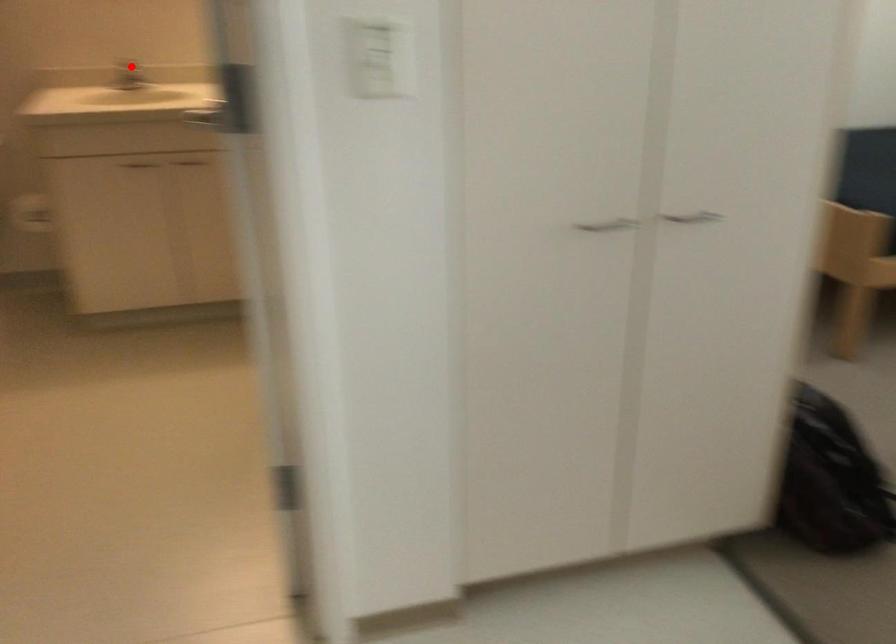
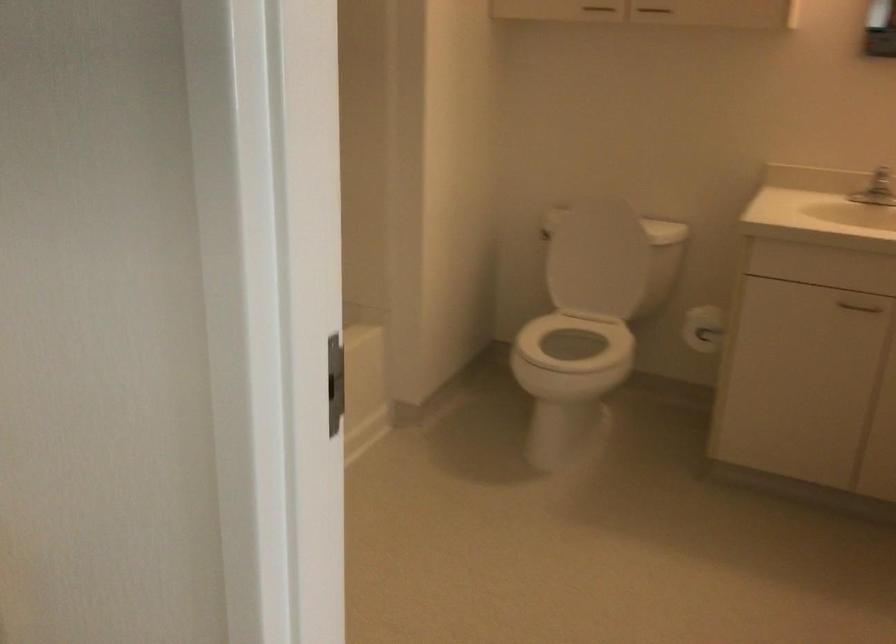
Question: I am providing you with two images of the same scene from different viewpoints. A red point is marked on the first image. Is the red point's position out of view in image 2?

Choices:
 (A) Yes
 (B) No

Answer: (B)